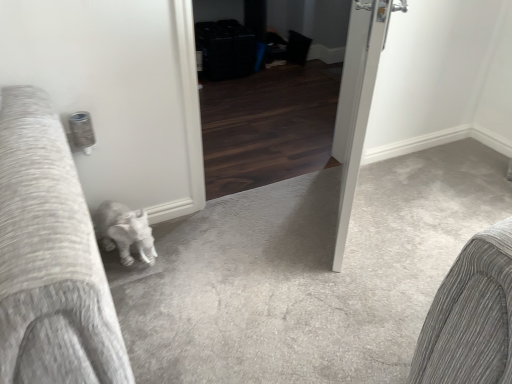
Describe the element at coordinates (275, 108) in the screenshot. The height and width of the screenshot is (384, 512). I see `dark wood screen door at center` at that location.

You are a GUI agent. You are given a task and a screenshot of the screen. Output one action in this format:
    pyautogui.click(x=<x>, y=<y>)
    Task: Click on the dark wood screen door at center
    
    Given the screenshot: What is the action you would take?
    pyautogui.click(x=275, y=108)

The width and height of the screenshot is (512, 384). In order to click on white glossy door at center in this screenshot , I will do `click(360, 104)`.

This screenshot has width=512, height=384. What do you see at coordinates (360, 104) in the screenshot?
I see `white glossy door at center` at bounding box center [360, 104].

In order to click on dark wood screen door at center in this screenshot , I will do `click(275, 108)`.

Can you confirm if dark wood screen door at center is positioned to the left of white glossy door at center?

Correct, you'll find dark wood screen door at center to the left of white glossy door at center.

Which is behind, dark wood screen door at center or white glossy door at center?

dark wood screen door at center is further away from the camera.

Does point (259, 85) come behind point (345, 236)?

That is True.

From the image's perspective, which one is positioned lower, dark wood screen door at center or white glossy door at center?

From the image's view, white glossy door at center is below.

From a real-world perspective, who is located higher, dark wood screen door at center or white glossy door at center?

In real-world perspective, white glossy door at center is above.

Is dark wood screen door at center thinner than white glossy door at center?

No.

Does dark wood screen door at center have a lesser height compared to white glossy door at center?

Indeed, dark wood screen door at center has a lesser height compared to white glossy door at center.

Between dark wood screen door at center and white glossy door at center, which one has larger size?

With larger size is dark wood screen door at center.

Is dark wood screen door at center not within white glossy door at center?

Indeed, dark wood screen door at center is completely outside white glossy door at center.

Based on the photo, are dark wood screen door at center and white glossy door at center making contact?

No, dark wood screen door at center is not with white glossy door at center.

Is dark wood screen door at center aimed at white glossy door at center?

Yes, dark wood screen door at center faces towards white glossy door at center.

How far apart are dark wood screen door at center and white glossy door at center?

A distance of 34.98 inches exists between dark wood screen door at center and white glossy door at center.

Where is `door below the dark wood screen door at center (from the image's perspective)`? door below the dark wood screen door at center (from the image's perspective) is located at coordinates (360, 104).

Which is more to the right, white glossy door at center or dark wood screen door at center?

white glossy door at center.

Between white glossy door at center and dark wood screen door at center, which one is positioned in front?

white glossy door at center is closer to the camera.

Which is less distant, (371, 24) or (346, 29)?

The point (371, 24) is in front.

From the image's perspective, which is below, white glossy door at center or dark wood screen door at center?

white glossy door at center, from the image's perspective.

From a real-world perspective, is white glossy door at center located beneath dark wood screen door at center?

No.

Considering the relative sizes of white glossy door at center and dark wood screen door at center in the image provided, is white glossy door at center thinner than dark wood screen door at center?

Correct, the width of white glossy door at center is less than that of dark wood screen door at center.

Does white glossy door at center have a lesser height compared to dark wood screen door at center?

Incorrect, the height of white glossy door at center does not fall short of that of dark wood screen door at center.

Considering the sizes of objects white glossy door at center and dark wood screen door at center in the image provided, who is bigger, white glossy door at center or dark wood screen door at center?

Bigger between the two is dark wood screen door at center.

Is white glossy door at center completely or partially outside of dark wood screen door at center?

Yes, white glossy door at center is outside of dark wood screen door at center.

Is white glossy door at center not close to dark wood screen door at center?

No.

Based on the photo, is white glossy door at center positioned with its back to dark wood screen door at center?

Yes, white glossy door at center is facing away from dark wood screen door at center.

Can you tell me how much white glossy door at center and dark wood screen door at center differ in facing direction?

They differ by 129 degrees in their facing directions.

How distant is white glossy door at center from dark wood screen door at center?

A distance of 88.86 centimeters exists between white glossy door at center and dark wood screen door at center.

The height and width of the screenshot is (384, 512). What are the coordinates of `door below the dark wood screen door at center (from the image's perspective)` in the screenshot? It's located at (360, 104).

The image size is (512, 384). I want to click on door that is below the dark wood screen door at center (from the image's perspective), so click(360, 104).

Find the location of a particular element. The image size is (512, 384). screen door above the white glossy door at center (from the image's perspective) is located at coordinates (275, 108).